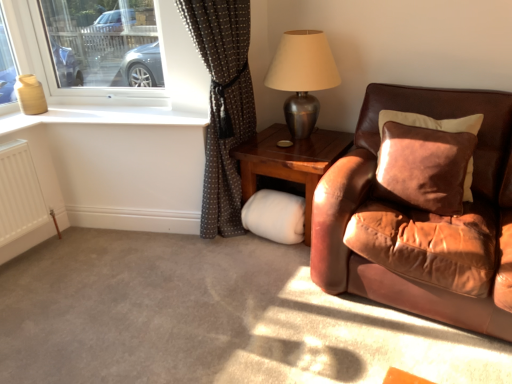
Describe the element at coordinates (302, 77) in the screenshot. The width and height of the screenshot is (512, 384). I see `metallic silver table lamp at upper right` at that location.

The image size is (512, 384). What do you see at coordinates (417, 219) in the screenshot? I see `brown leather couch at right` at bounding box center [417, 219].

Describe the element at coordinates (223, 106) in the screenshot. This screenshot has width=512, height=384. I see `brown dotted fabric at left` at that location.

Measure the distance between clear glass window at upper left and camera.

clear glass window at upper left and camera are 7.28 feet apart from each other.

Locate an element on the screen. clear glass window at upper left is located at coordinates (115, 87).

This screenshot has height=384, width=512. What do you see at coordinates (102, 117) in the screenshot?
I see `white glossy window sill at upper left` at bounding box center [102, 117].

The width and height of the screenshot is (512, 384). Identify the location of white matte radiator at lower left. coord(19,193).

I want to click on suede brown pillow at right, so click(431, 122).

What is the approximate height of suede brown pillow at right?

The height of suede brown pillow at right is 16.75 inches.

The image size is (512, 384). In order to click on wooden side table at right in this screenshot , I will do `click(290, 161)`.

Identify the location of metallic silver table lamp at upper right. (302, 77).

Is wooden side table at right aimed at metallic silver table lamp at upper right?

Answer: No, wooden side table at right is not facing towards metallic silver table lamp at upper right.

Does wooden side table at right have a lesser width compared to metallic silver table lamp at upper right?

No.

Where is `table below the metallic silver table lamp at upper right (from a real-world perspective)`? table below the metallic silver table lamp at upper right (from a real-world perspective) is located at coordinates (290, 161).

Consider the image. Is wooden side table at right not within metallic silver table lamp at upper right?

Absolutely, wooden side table at right is external to metallic silver table lamp at upper right.

Which object is thinner, brown leather couch at right or wooden side table at right?

wooden side table at right is thinner.

Consider the image. Is wooden side table at right located within brown leather couch at right?

No, brown leather couch at right does not contain wooden side table at right.

Is brown leather couch at right facing towards wooden side table at right?

No.

Does point (186, 76) appear closer or farther from the camera than point (405, 118)?

Point (186, 76).

Which object is positioned more to the right, clear glass window at upper left or suede brown pillow at right?

suede brown pillow at right.

Does clear glass window at upper left have a greater width compared to suede brown pillow at right?

No, clear glass window at upper left is not wider than suede brown pillow at right.

Looking at this image, is clear glass window at upper left aimed at suede brown pillow at right?

No, clear glass window at upper left does not turn towards suede brown pillow at right.

Is clear glass window at upper left beside wooden side table at right?

No.

Find the location of a particular element. The width and height of the screenshot is (512, 384). table located in front of the clear glass window at upper left is located at coordinates (290, 161).

Considering the positions of point (41, 49) and point (325, 166), is point (41, 49) closer or farther from the camera than point (325, 166)?

Point (41, 49).

Is clear glass window at upper left positioned with its back to wooden side table at right?

clear glass window at upper left does not have its back to wooden side table at right.

Would you consider brown leather couch at right to be distant from brown dotted fabric at left?

brown leather couch at right is actually quite close to brown dotted fabric at left.

Can you confirm if brown leather couch at right is shorter than brown dotted fabric at left?

Yes.

Considering the positions of objects brown leather couch at right and brown dotted fabric at left in the image provided, who is more to the left, brown leather couch at right or brown dotted fabric at left?

brown dotted fabric at left is more to the left.

Is white glossy window sill at upper left with clear glass window at upper left?

white glossy window sill at upper left is not next to clear glass window at upper left, and they're not touching.

Is white glossy window sill at upper left wider or thinner than clear glass window at upper left?

In the image, white glossy window sill at upper left appears to be wider than clear glass window at upper left.

Which is behind, white glossy window sill at upper left or clear glass window at upper left?

clear glass window at upper left.

From the image's perspective, is brown dotted fabric at left over white glossy window sill at upper left?

No.

Who is bigger, brown dotted fabric at left or white glossy window sill at upper left?

brown dotted fabric at left.

Is brown dotted fabric at left at the right side of white glossy window sill at upper left?

Indeed, brown dotted fabric at left is positioned on the right side of white glossy window sill at upper left.

From a real-world perspective, between brown dotted fabric at left and white glossy window sill at upper left, who is vertically lower?

→ In real-world perspective, brown dotted fabric at left is lower.

Where is `table on the left side of metallic silver table lamp at upper right`? The width and height of the screenshot is (512, 384). table on the left side of metallic silver table lamp at upper right is located at coordinates (290, 161).

Locate an element on the screen. This screenshot has height=384, width=512. studio couch in front of the wooden side table at right is located at coordinates (417, 219).

Looking at the image, which one is located further to white glossy window sill at upper left, clear glass window at upper left or metallic silver table lamp at upper right?

metallic silver table lamp at upper right is further to white glossy window sill at upper left.

Looking at the image, which one is located further to clear glass window at upper left, suede brown pillow at right or white matte radiator at lower left?

suede brown pillow at right lies further to clear glass window at upper left than the other object.

From the image, which object appears to be nearer to white glossy window sill at upper left, brown dotted fabric at left or metallic silver table lamp at upper right?

The object closer to white glossy window sill at upper left is brown dotted fabric at left.

In the scene shown: Looking at the image, which one is located further to clear glass window at upper left, brown dotted fabric at left or suede brown pillow at right?

Based on the image, suede brown pillow at right appears to be further to clear glass window at upper left.

Looking at the image, which one is located closer to clear glass window at upper left, suede brown pillow at right or brown leather couch at right?

Based on the image, brown leather couch at right appears to be nearer to clear glass window at upper left.

Based on their spatial positions, is suede brown pillow at right or metallic silver table lamp at upper right closer to clear glass window at upper left?

Among the two, metallic silver table lamp at upper right is located nearer to clear glass window at upper left.

Considering their positions, is wooden side table at right positioned closer to suede brown pillow at right than brown dotted fabric at left?

wooden side table at right is positioned closer to the anchor suede brown pillow at right.

From the image, which object appears to be farther from white matte radiator at lower left, clear glass window at upper left or brown leather couch at right?

brown leather couch at right lies further to white matte radiator at lower left than the other object.

You are a GUI agent. You are given a task and a screenshot of the screen. Output one action in this format:
    pyautogui.click(x=<x>, y=<y>)
    Task: Click on the window sill between white matte radiator at lower left and wooden side table at right from left to right
    
    Given the screenshot: What is the action you would take?
    pyautogui.click(x=102, y=117)

Locate an element on the screen. The image size is (512, 384). window between white matte radiator at lower left and brown dotted fabric at left is located at coordinates click(115, 87).

You are a GUI agent. You are given a task and a screenshot of the screen. Output one action in this format:
    pyautogui.click(x=<x>, y=<y>)
    Task: Click on the table situated between clear glass window at upper left and metallic silver table lamp at upper right from left to right
    
    Given the screenshot: What is the action you would take?
    pyautogui.click(x=290, y=161)

The height and width of the screenshot is (384, 512). I want to click on table lamp between clear glass window at upper left and suede brown pillow at right from left to right, so click(x=302, y=77).